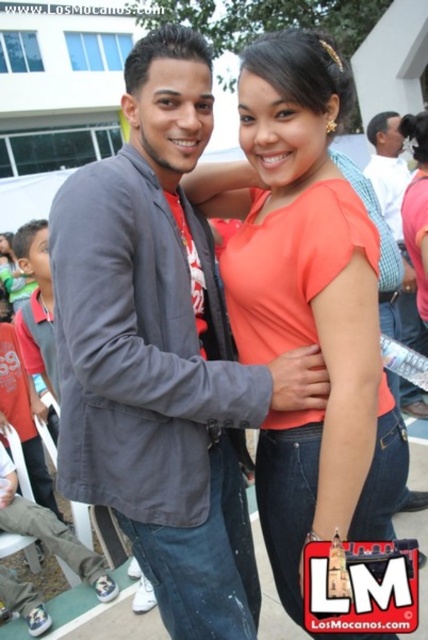
Question: Which point appears farthest from the camera in this image?

Choices:
 (A) (86, 193)
 (B) (272, 356)

Answer: (B)

Question: Is matte gray blazer at center further to the viewer compared to matte orange blouse at center?

Choices:
 (A) no
 (B) yes

Answer: (A)

Question: Which point is closer to the camera taking this photo?

Choices:
 (A) (413, 396)
 (B) (160, 385)
 (C) (318, 120)

Answer: (B)

Question: Does matte gray blazer at center have a lesser width compared to brushed metal shirt at center?

Choices:
 (A) yes
 (B) no

Answer: (B)

Question: Among these objects, which one is farthest from the camera?

Choices:
 (A) matte gray blazer at center
 (B) brushed metal shirt at center
 (C) matte orange blouse at center

Answer: (B)

Question: Is matte gray blazer at center smaller than brushed metal shirt at center?

Choices:
 (A) no
 (B) yes

Answer: (B)